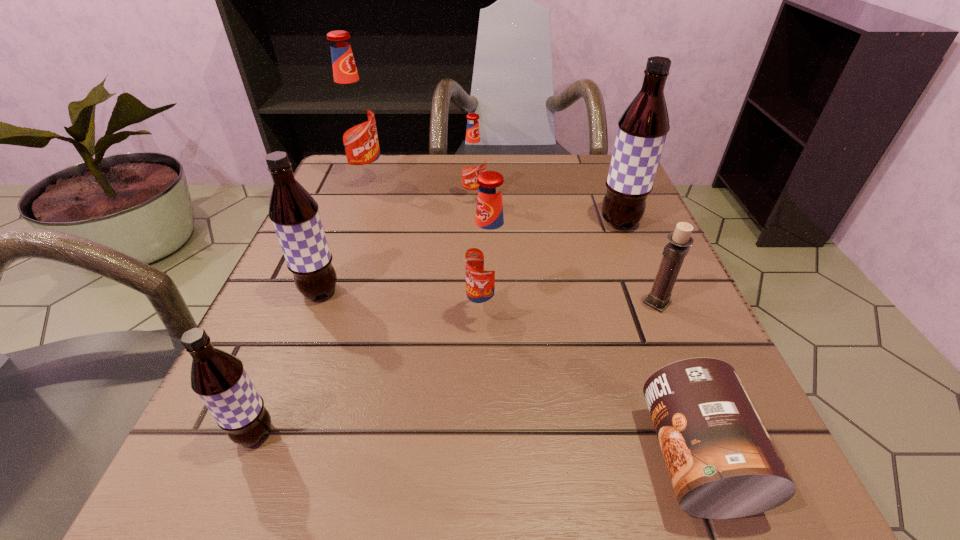
Locate which red root beer is the second closest to the biggest red root beer. Please provide its 2D coordinates. Your answer should be formatted as a tuple, i.e. [(x, y)], where the tuple contains the x and y coordinates of a point satisfying the conditions above.

[(489, 256)]

The height and width of the screenshot is (540, 960). What are the coordinates of `brown root beer that is the closest to the farthest root beer` in the screenshot? It's located at (294, 213).

Identify the location of brown root beer that is the second closest one to the can. The width and height of the screenshot is (960, 540). (219, 379).

Find the location of a particular element. vacant space that satisfies the following two spatial constraints: 1. on the front side of the second nearest red root beer; 2. on the right side of the second shortest object is located at coordinates (471, 303).